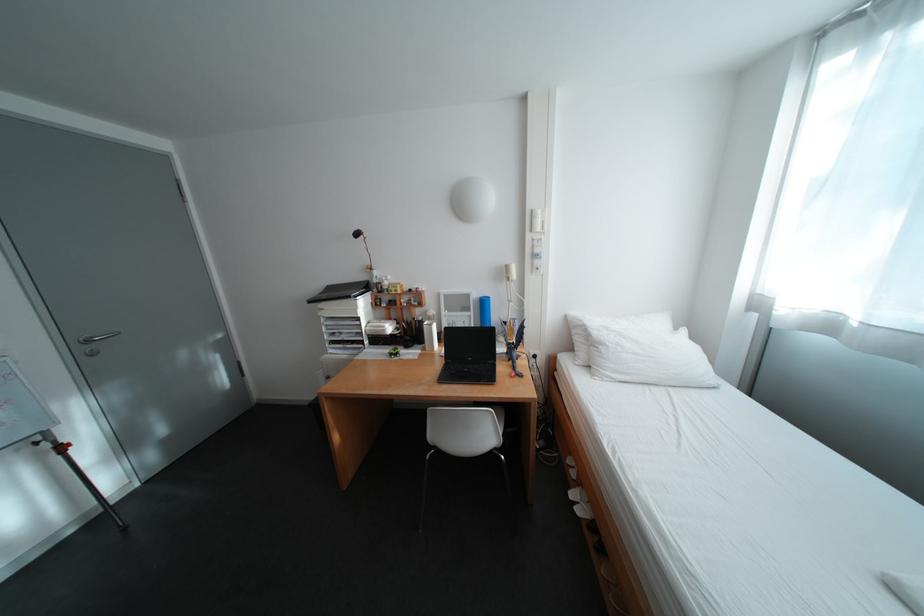
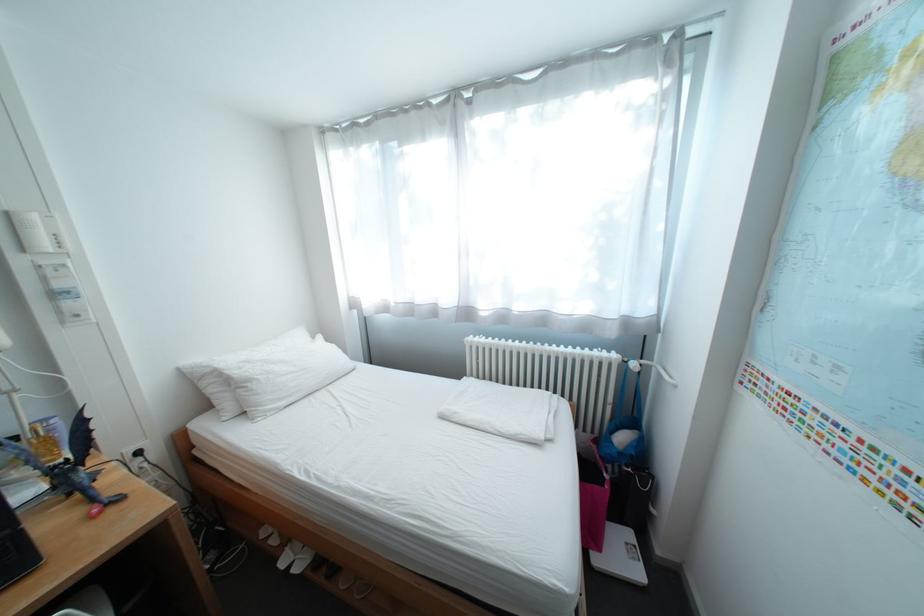
Question: Based on the continuous images, in which direction is the camera rotating? Reply with the corresponding letter.

Choices:
 (A) Left
 (B) Right
 (C) Up
 (D) Down

Answer: (B)